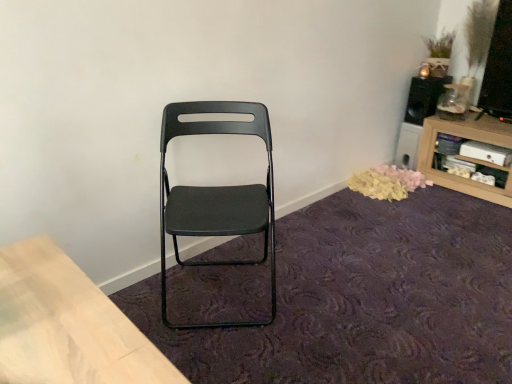
You are a GUI agent. You are given a task and a screenshot of the screen. Output one action in this format:
    pyautogui.click(x=<x>, y=<y>)
    Task: Click on the vacant space to the right of yellow fabric petals at lower right
    
    Given the screenshot: What is the action you would take?
    pyautogui.click(x=455, y=195)